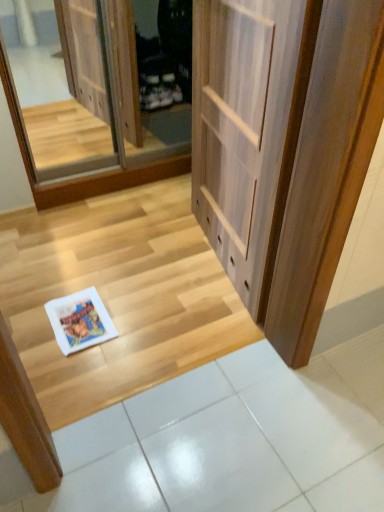
Locate an element on the screen. This screenshot has height=512, width=384. white paper magazine at lower left is located at coordinates (80, 321).

Locate an element on the screen. The width and height of the screenshot is (384, 512). clear glass screen door at upper left is located at coordinates (86, 102).

Find the location of `light wood door at center`. light wood door at center is located at coordinates (284, 147).

Which is closer, (226,9) or (126,185)?

Point (226,9).

Is light wood door at center closer to the viewer compared to clear glass screen door at upper left?

That is True.

Where is `door that is above the clear glass screen door at upper left (from a real-world perspective)`? The height and width of the screenshot is (512, 384). door that is above the clear glass screen door at upper left (from a real-world perspective) is located at coordinates (284, 147).

Which of these two, light wood door at center or clear glass screen door at upper left, is bigger?

Bigger between the two is clear glass screen door at upper left.

You are a GUI agent. You are given a task and a screenshot of the screen. Output one action in this format:
    pyautogui.click(x=<x>, y=<y>)
    Task: Click on the magazine that appears below the light wood door at center (from a real-world perspective)
    This screenshot has width=384, height=512.
    Given the screenshot: What is the action you would take?
    pyautogui.click(x=80, y=321)

From the image's perspective, between light wood door at center and white paper magazine at lower left, which one is located above?

light wood door at center appears higher in the image.

Which object is thinner, light wood door at center or white paper magazine at lower left?

light wood door at center is thinner.

Is white glossy tile at lower center far from white paper magazine at lower left?

No, white glossy tile at lower center is not far from white paper magazine at lower left.

Considering the sizes of objects white glossy tile at lower center and white paper magazine at lower left in the image provided, who is smaller, white glossy tile at lower center or white paper magazine at lower left?

white paper magazine at lower left is smaller.

Is white paper magazine at lower left inside white glossy tile at lower center?

No, white glossy tile at lower center does not contain white paper magazine at lower left.

Is white glossy tile at lower center facing away from white paper magazine at lower left?

That's not correct — white glossy tile at lower center is not looking away from white paper magazine at lower left.

From the image's perspective, is wooden floor at lower left below white glossy tile at lower center?

Incorrect, from the image's perspective, wooden floor at lower left is higher than white glossy tile at lower center.

Is wooden floor at lower left taller or shorter than white glossy tile at lower center?

Clearly, wooden floor at lower left is shorter compared to white glossy tile at lower center.

Is wooden floor at lower left outside of white glossy tile at lower center?

Yes, wooden floor at lower left is not within white glossy tile at lower center.

Does wooden floor at lower left have a lesser width compared to white glossy tile at lower center?

No.

Which point is more distant from viewer, (71,440) or (174,282)?

Point (174,282)

Considering the relative sizes of white glossy tile at lower center and wooden floor at lower left in the image provided, is white glossy tile at lower center wider than wooden floor at lower left?

In fact, white glossy tile at lower center might be narrower than wooden floor at lower left.

Does white glossy tile at lower center touch wooden floor at lower left?

No, white glossy tile at lower center is not with wooden floor at lower left.

Is white glossy tile at lower center further to camera compared to wooden floor at lower left?

No, it is not.

In the scene shown: Are white paper magazine at lower left and light wood door at center making contact?

white paper magazine at lower left and light wood door at center are clearly separated.

How much distance is there between white paper magazine at lower left and light wood door at center?

white paper magazine at lower left is 32.01 inches from light wood door at center.

Does white paper magazine at lower left have a larger size compared to light wood door at center?

No, white paper magazine at lower left is not bigger than light wood door at center.

Who is more distant, white paper magazine at lower left or light wood door at center?

white paper magazine at lower left is behind.

Consider the image. From the image's perspective, is white glossy tile at lower center positioned above or below clear glass screen door at upper left?

white glossy tile at lower center is situated lower than clear glass screen door at upper left in the image.

Considering the relative sizes of white glossy tile at lower center and clear glass screen door at upper left in the image provided, is white glossy tile at lower center smaller than clear glass screen door at upper left?

Yes, white glossy tile at lower center is smaller than clear glass screen door at upper left.

Considering the points (358, 355) and (142, 173), which point is behind, point (358, 355) or point (142, 173)?

The point (142, 173) is farther from the camera.

Looking at this image, considering the relative sizes of white glossy tile at lower center and clear glass screen door at upper left in the image provided, is white glossy tile at lower center thinner than clear glass screen door at upper left?

No, white glossy tile at lower center is not thinner than clear glass screen door at upper left.

The height and width of the screenshot is (512, 384). Find the location of `screen door below the light wood door at center (from a real-world perspective)`. screen door below the light wood door at center (from a real-world perspective) is located at coordinates pos(86,102).

Identify the location of door above the white paper magazine at lower left (from a real-world perspective). (284, 147).

When comparing their distances from clear glass screen door at upper left, does white paper magazine at lower left or light wood door at center seem further?

Among the two, white paper magazine at lower left is located further to clear glass screen door at upper left.

When comparing their distances from light wood door at center, does clear glass screen door at upper left or white glossy tile at lower center seem further?

Based on the image, clear glass screen door at upper left appears to be further to light wood door at center.

Based on their spatial positions, is clear glass screen door at upper left or wooden floor at lower left further from light wood door at center?

Based on the image, clear glass screen door at upper left appears to be further to light wood door at center.

Considering their positions, is clear glass screen door at upper left positioned further to wooden floor at lower left than white glossy tile at lower center?

clear glass screen door at upper left.

Based on their spatial positions, is wooden floor at lower left or clear glass screen door at upper left closer to white glossy tile at lower center?

wooden floor at lower left is closer to white glossy tile at lower center.

From the image, which object appears to be farther from white paper magazine at lower left, clear glass screen door at upper left or white glossy tile at lower center?

clear glass screen door at upper left.

Considering their positions, is white paper magazine at lower left positioned closer to white glossy tile at lower center than wooden floor at lower left?

wooden floor at lower left lies closer to white glossy tile at lower center than the other object.

Based on their spatial positions, is white glossy tile at lower center or light wood door at center further from clear glass screen door at upper left?

white glossy tile at lower center lies further to clear glass screen door at upper left than the other object.

Identify the location of door between clear glass screen door at upper left and wooden floor at lower left from top to bottom. (284, 147).

At what (x,y) coordinates should I click in order to perform the action: click on stairwell between white glossy tile at lower center and white paper magazine at lower left from front to back. Please return your answer as a coordinate pair (x, y). The height and width of the screenshot is (512, 384). Looking at the image, I should click on (118, 295).

Locate an element on the screen. This screenshot has width=384, height=512. stairwell that lies between clear glass screen door at upper left and white glossy tile at lower center from top to bottom is located at coordinates (118, 295).

Find the location of `stairwell between clear glass screen door at upper left and white paper magazine at lower left in the up-down direction`. stairwell between clear glass screen door at upper left and white paper magazine at lower left in the up-down direction is located at coordinates (118, 295).